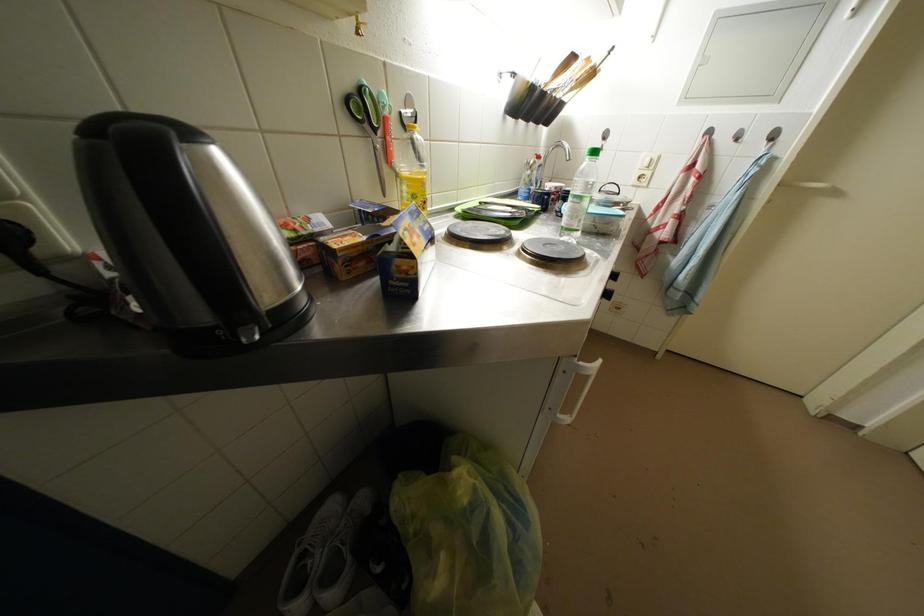
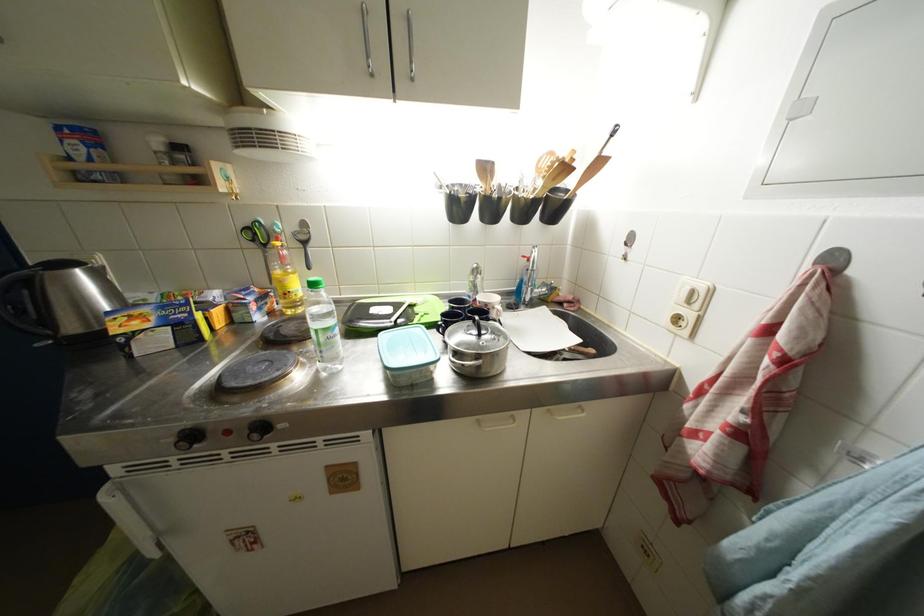
Find the pixel in the second image that matches (x=355, y=89) in the first image.

(253, 227)